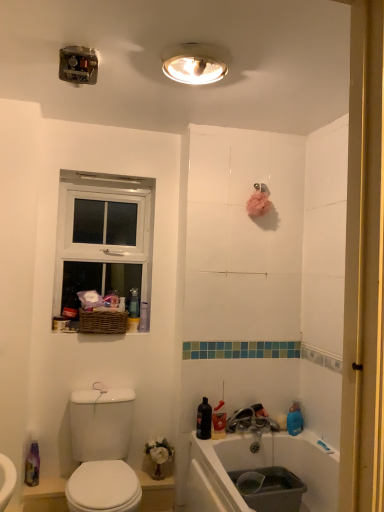
The height and width of the screenshot is (512, 384). Identify the location of vacant area located to the right-hand side of translucent plastic spray bottle at lower left. (47, 482).